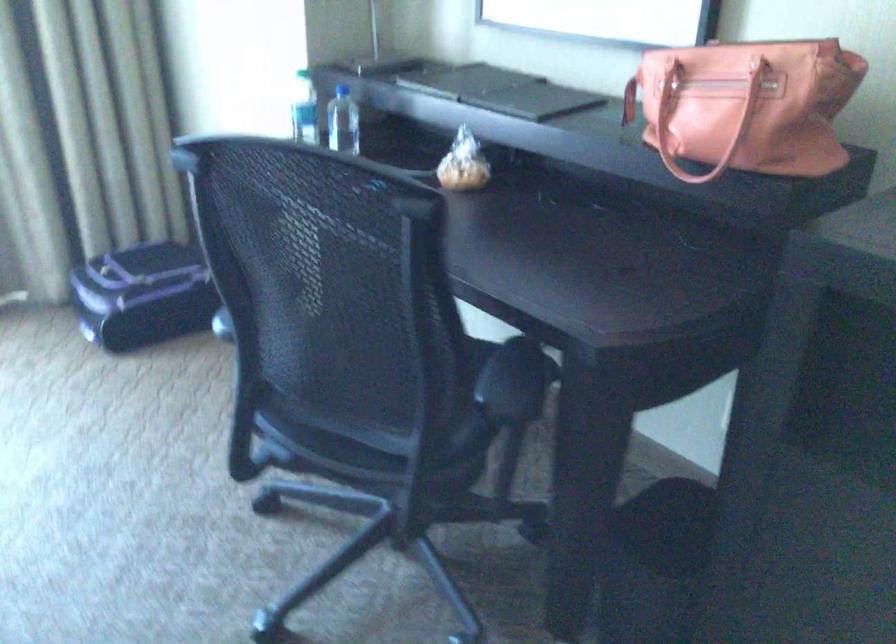
Describe the element at coordinates (513, 383) in the screenshot. I see `the chair armrest` at that location.